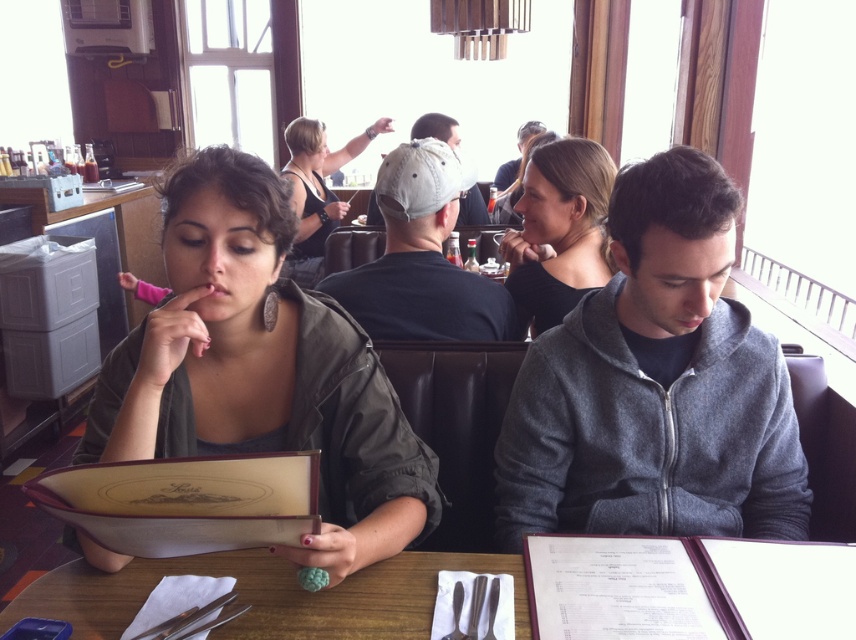
You are a waiter in a restaurant. You see a customer wearing a matte green jacket at left and another wearing a white cap at center. Which customer is closer to the entrance if the entrance is to the right of the table?

The white cap at center is closer to the entrance since the entrance is to the right of the table, and the white cap is positioned to the right of the matte green jacket at left.

You are a waiter in a restaurant and need to take an order from the two people at the table. The gray fleece jacket at right and the matte black hair at upper center are sitting at the table. Which one is sitting to the left of the other?

The gray fleece jacket at right is positioned on the left side of matte black hair at upper center, so the person wearing the gray fleece jacket at right is sitting to the left of the person with matte black hair at upper center.

You are a waiter in a cafe and need to take an order from two customers. One is wearing a matte green jacket at left and the other has a white cap at center. According to the spatial arrangement, which customer should you approach first to ensure you follow proper etiquette?

You should approach the matte green jacket at left first because they are closer to you, as the matte green jacket at left is in front of the white cap at center.